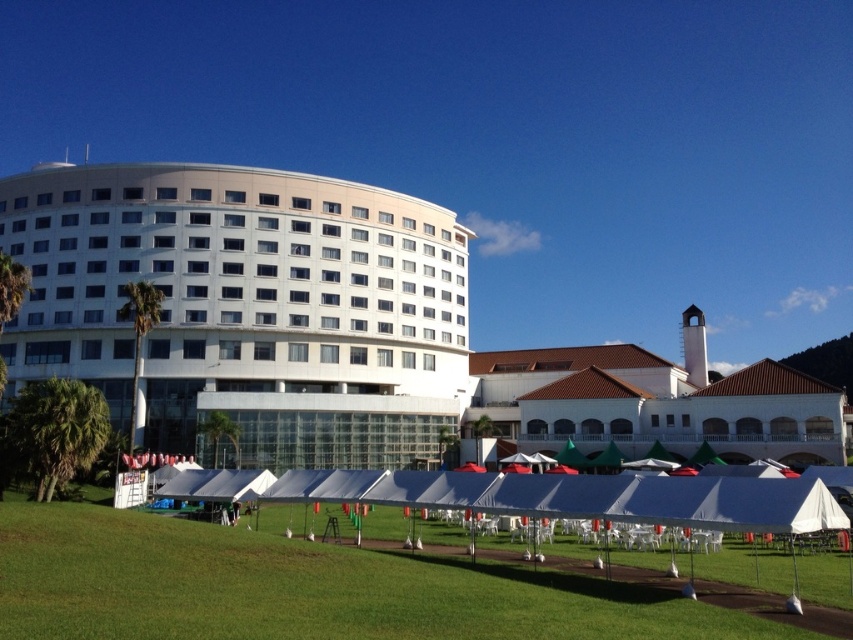
From the picture: You are standing at the entrance of the white smooth building at left and want to see the white fabric tent at lower center. Can you see it without any obstruction?

The white smooth building at left is taller than the white fabric tent at lower center, so there might be an obstruction from the building itself or its surroundings.

You are standing at point (476, 476) and want to walk to the main circular building. Is the point (13, 176) blocking your path?

Point (13, 176) is behind point (476, 476), so it is not blocking your path to the main circular building.